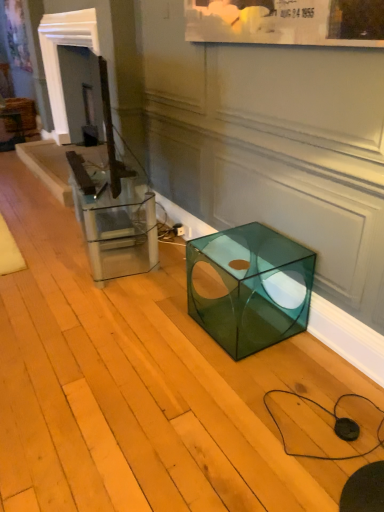
Find the location of a particular element. free space in front of clear glass cube at center is located at coordinates (87, 304).